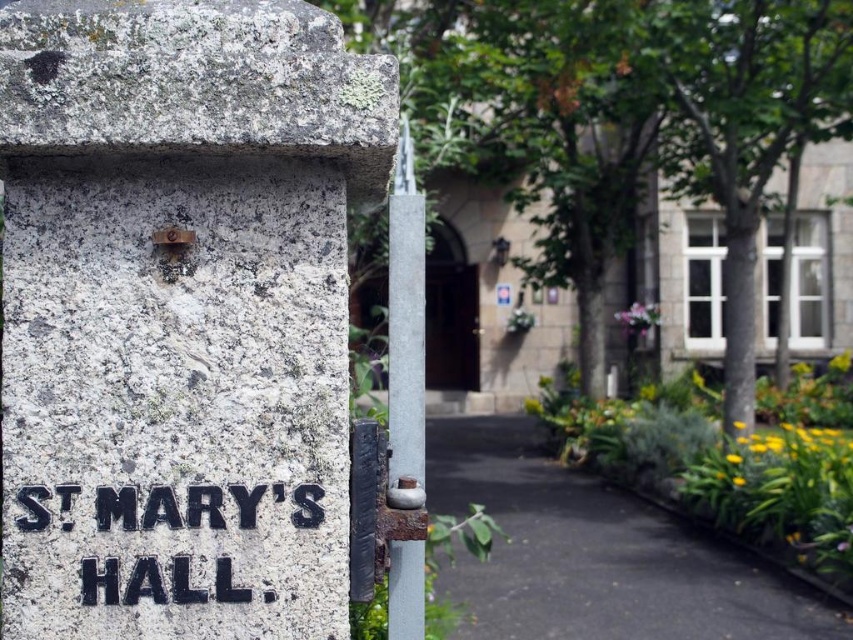
Is the position of granite sign at center less distant than that of black asphalt at center?

Yes, granite sign at center is in front of black asphalt at center.

Which is more to the right, granite sign at center or black asphalt at center?

black asphalt at center is more to the right.

In order to click on granite sign at center in this screenshot , I will do `click(180, 312)`.

Locate an element on the screen. This screenshot has width=853, height=640. granite sign at center is located at coordinates (180, 312).

Who is positioned more to the left, black asphalt at center or black cast iron sign at lower left?

black cast iron sign at lower left is more to the left.

Does black asphalt at center appear under black cast iron sign at lower left?

Indeed, black asphalt at center is positioned under black cast iron sign at lower left.

Describe the element at coordinates (596, 554) in the screenshot. I see `black asphalt at center` at that location.

Where is `black asphalt at center`? This screenshot has width=853, height=640. black asphalt at center is located at coordinates (596, 554).

Between granite sign at center and black cast iron sign at lower left, which one is positioned lower?

Positioned lower is black cast iron sign at lower left.

Which is more to the right, granite sign at center or black cast iron sign at lower left?

granite sign at center is more to the right.

What do you see at coordinates (180, 312) in the screenshot? The width and height of the screenshot is (853, 640). I see `granite sign at center` at bounding box center [180, 312].

At what (x,y) coordinates should I click in order to perform the action: click on granite sign at center. Please return your answer as a coordinate pair (x, y). The image size is (853, 640). Looking at the image, I should click on [x=180, y=312].